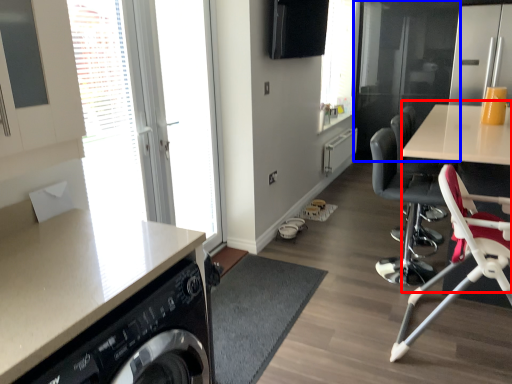
Question: Which object is further to the camera taking this photo, computer desk (highlighted by a red box) or screen door (highlighted by a blue box)?

Choices:
 (A) computer desk
 (B) screen door

Answer: (B)